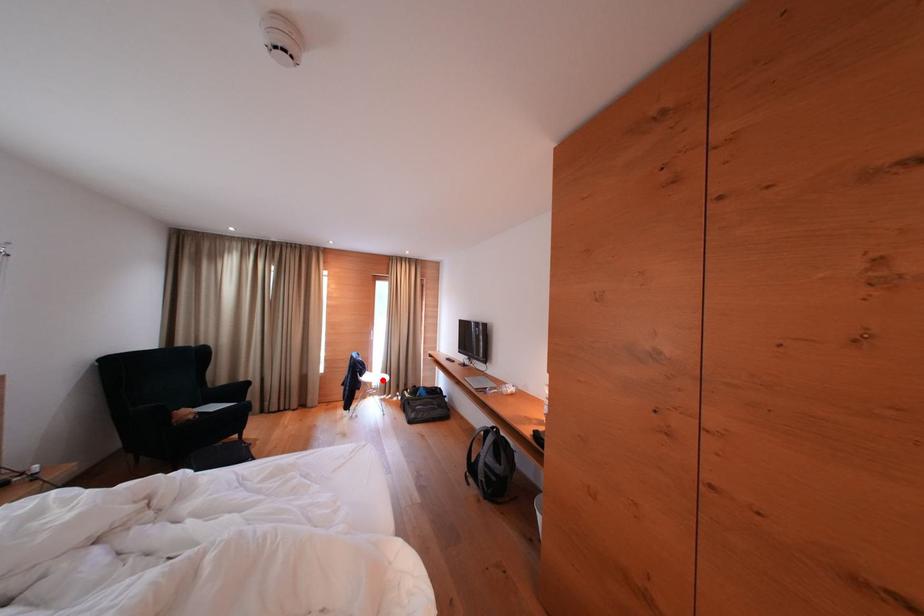
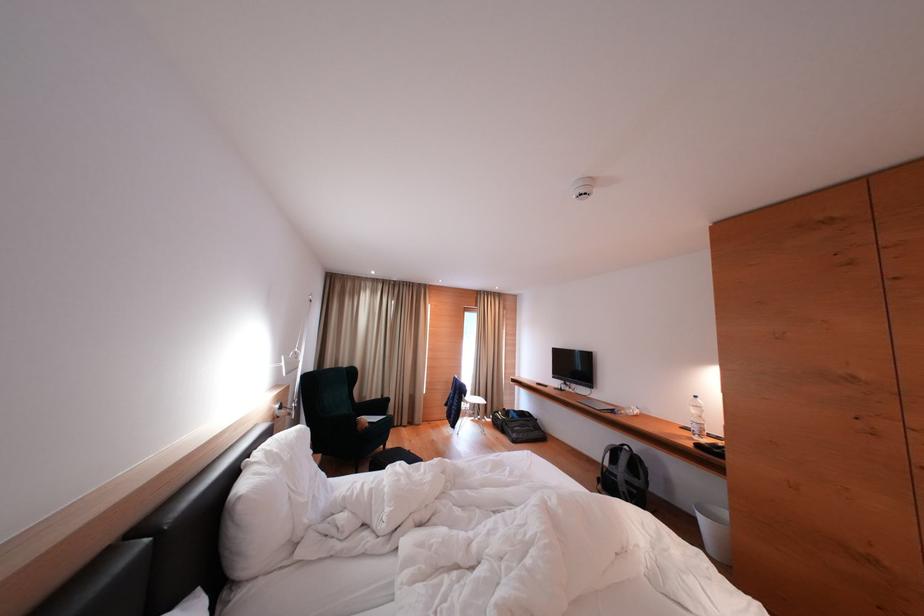
Question: A red point is marked in image1. In image2, is the corresponding 3D point closer to the camera or farther? Reply with the corresponding letter.

Choices:
 (A) The corresponding 3D point is closer.
 (B) The corresponding 3D point is farther.

Answer: (B)